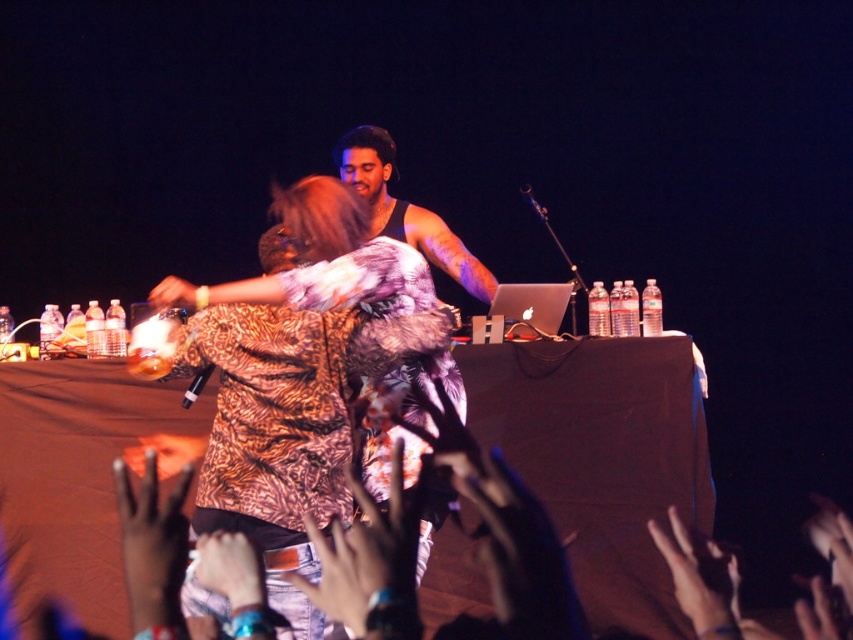
Question: Does leather glove at lower center have a lesser width compared to smooth skin hand at center?

Choices:
 (A) no
 (B) yes

Answer: (A)

Question: Which point is closer to the camera taking this photo?

Choices:
 (A) (413, 579)
 (B) (198, 371)
 (C) (532, 200)

Answer: (A)

Question: Which object is closer to the camera taking this photo?

Choices:
 (A) metallic silver microphone at center
 (B) smooth skin hand at center
 (C) leopard print shirt at center
 (D) leather glove at lower center

Answer: (D)

Question: Can you confirm if matte black hand at center is positioned below metallic silver microphone at center?

Choices:
 (A) no
 (B) yes

Answer: (B)

Question: Is matte black hand at center in front of metallic silver microphone at center?

Choices:
 (A) no
 (B) yes

Answer: (B)

Question: Considering the real-world distances, which object is farthest from the leopard print shirt at center?

Choices:
 (A) black plastic microphone at center
 (B) smooth skin hand at center
 (C) matte black hand at center

Answer: (B)